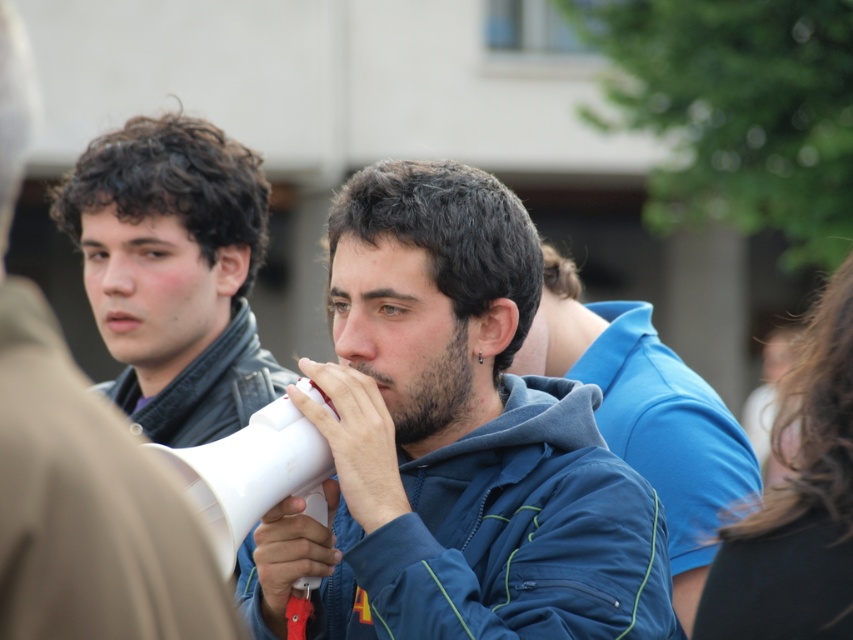
Is the position of blue fabric shirt at center more distant than that of white plastic megaphone at center?

Yes, blue fabric shirt at center is further from the viewer.

Looking at this image, does blue fabric shirt at center have a lesser width compared to white plastic megaphone at center?

In fact, blue fabric shirt at center might be wider than white plastic megaphone at center.

Image resolution: width=853 pixels, height=640 pixels. Identify the location of blue fabric shirt at center. (647, 417).

Can you confirm if matte black jacket at left is bigger than white plastic megaphone at center?

Indeed, matte black jacket at left has a larger size compared to white plastic megaphone at center.

Between matte black jacket at left and white plastic megaphone at center, which one appears on the right side from the viewer's perspective?

white plastic megaphone at center is more to the right.

This screenshot has height=640, width=853. I want to click on matte black jacket at left, so click(79, 465).

I want to click on matte black jacket at left, so click(x=79, y=465).

Describe the element at coordinates (456, 440) in the screenshot. I see `blue fleece jacket at center` at that location.

Which is behind, point (399, 360) or point (325, 458)?

Point (399, 360)

Locate an element on the screen. blue fleece jacket at center is located at coordinates (456, 440).